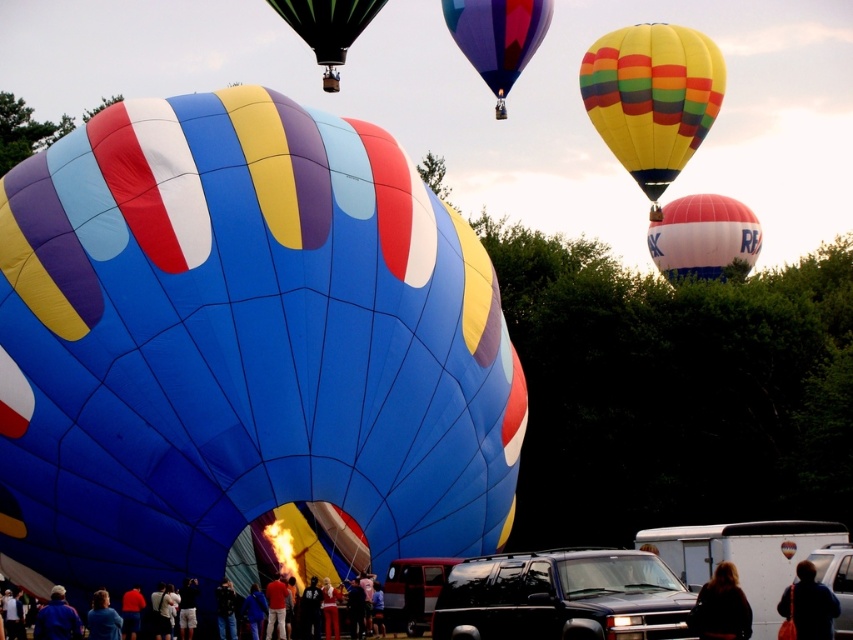
Where is `white/red/striped balloon at right`? This screenshot has height=640, width=853. white/red/striped balloon at right is located at coordinates (703, 236).

This screenshot has width=853, height=640. Find the location of `white/red/striped balloon at right`. white/red/striped balloon at right is located at coordinates (703, 236).

Who is more distant from viewer, (227, 595) or (392, 637)?

Positioned behind is point (392, 637).

This screenshot has height=640, width=853. What do you see at coordinates (225, 609) in the screenshot?
I see `dark blue jacket at lower center` at bounding box center [225, 609].

You are a GUI agent. You are given a task and a screenshot of the screen. Output one action in this format:
    pyautogui.click(x=<x>, y=<y>)
    Task: Click on the dark blue jacket at lower center
    This screenshot has width=853, height=640.
    Given the screenshot: What is the action you would take?
    point(225,609)

Does green striped hot air balloon at upper center have a smaller size compared to dark blue jacket at lower center?

Actually, green striped hot air balloon at upper center might be larger than dark blue jacket at lower center.

Can you confirm if green striped hot air balloon at upper center is shorter than dark blue jacket at lower center?

Incorrect, green striped hot air balloon at upper center's height does not fall short of dark blue jacket at lower center's.

Is point (296, 22) positioned before point (231, 624)?

No, (296, 22) is behind (231, 624).

Where is `green striped hot air balloon at upper center`? This screenshot has height=640, width=853. green striped hot air balloon at upper center is located at coordinates (328, 28).